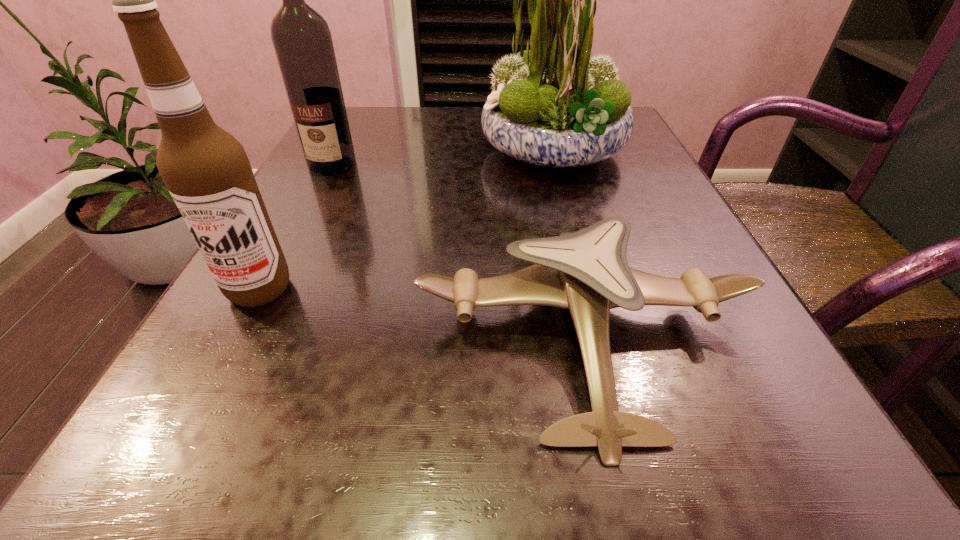
Image resolution: width=960 pixels, height=540 pixels. Identify the location of flower arrangement. (553, 106).

Locate an element on the screen. This screenshot has width=960, height=540. the farther alcohol is located at coordinates (301, 37).

Identify the location of the nearer alcohol. The width and height of the screenshot is (960, 540). click(206, 170).

At what (x,y) coordinates should I click in order to perform the action: click on the shortest object. Please return your answer as a coordinate pair (x, y). Looking at the image, I should click on (587, 272).

Locate an element on the screen. This screenshot has width=960, height=540. free spot located 0.170m on the front-facing side of the flower arrangement is located at coordinates (399, 151).

Identify the location of free location located 0.320m on the front-facing side of the flower arrangement. (327, 151).

Locate an element on the screen. vacant space situated on the front-facing side of the flower arrangement is located at coordinates (337, 151).

The image size is (960, 540). What are the coordinates of `blank space located 0.360m on the front and back of the farther alcohol` in the screenshot? It's located at (254, 316).

Where is `free space located 0.120m on the label of the nearer alcohol`? free space located 0.120m on the label of the nearer alcohol is located at coordinates (205, 391).

This screenshot has height=540, width=960. I want to click on object that is positioned at the far edge, so click(x=553, y=106).